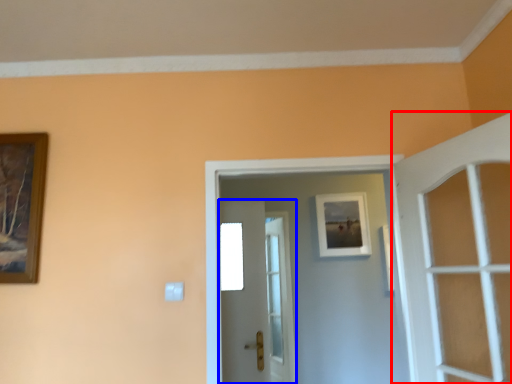
Question: Which object is closer to the camera taking this photo, door (highlighted by a red box) or door (highlighted by a blue box)?

Choices:
 (A) door
 (B) door

Answer: (A)